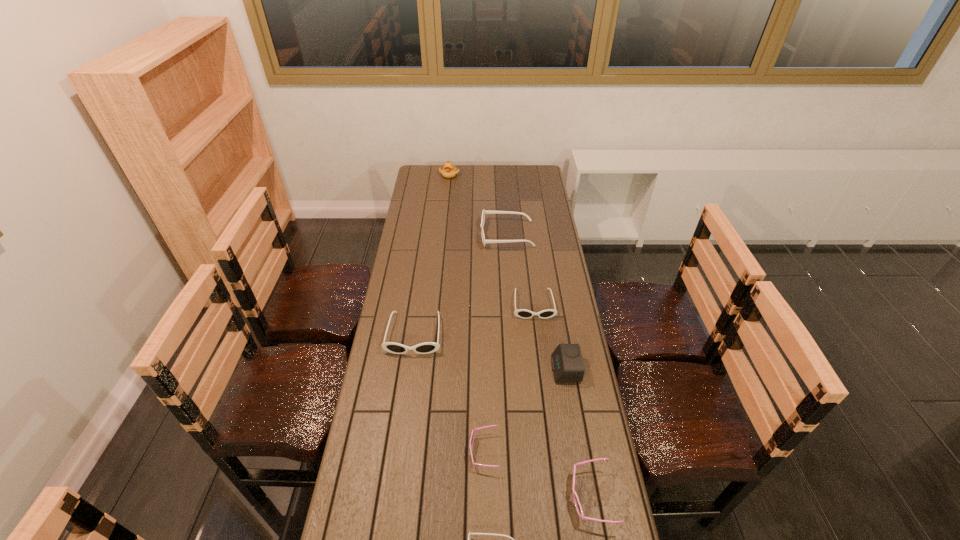
Where is `the farthest object`? This screenshot has height=540, width=960. the farthest object is located at coordinates (449, 171).

Locate an element on the screen. duckling is located at coordinates (449, 171).

At what (x,y) coordinates should I click in order to perform the action: click on the biggest black sunglasses. Please return your answer as a coordinate pair (x, y). The height and width of the screenshot is (540, 960). Looking at the image, I should click on (484, 212).

This screenshot has width=960, height=540. What are the coordinates of `the second farthest object` in the screenshot? It's located at (484, 212).

Where is `alarm clock`? The image size is (960, 540). alarm clock is located at coordinates (567, 363).

The height and width of the screenshot is (540, 960). I want to click on the leftmost black sunglasses, so click(428, 347).

This screenshot has width=960, height=540. What are the coordinates of `the leftmost sunglasses` in the screenshot? It's located at (428, 347).

At what (x,y) coordinates should I click in order to perform the action: click on the bigger pink sunglasses. Please return your answer as a coordinate pair (x, y). Image resolution: width=960 pixels, height=540 pixels. Looking at the image, I should click on (577, 504).

This screenshot has height=540, width=960. What are the coordinates of `the second smallest black sunglasses` in the screenshot? It's located at (521, 313).

Image resolution: width=960 pixels, height=540 pixels. Identify the location of the smaller pink sunglasses. (472, 436).